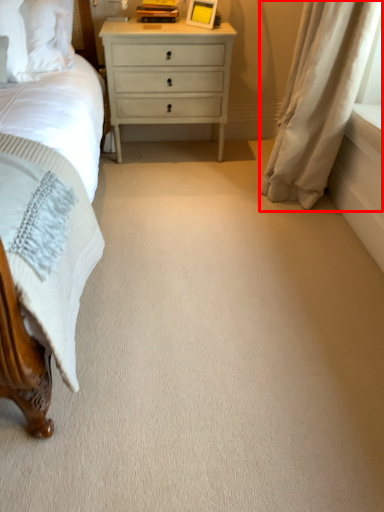
Question: From the image's perspective, what is the correct spatial positioning of curtain (annotated by the red box) in reference to nightstand?

Choices:
 (A) below
 (B) above

Answer: (A)